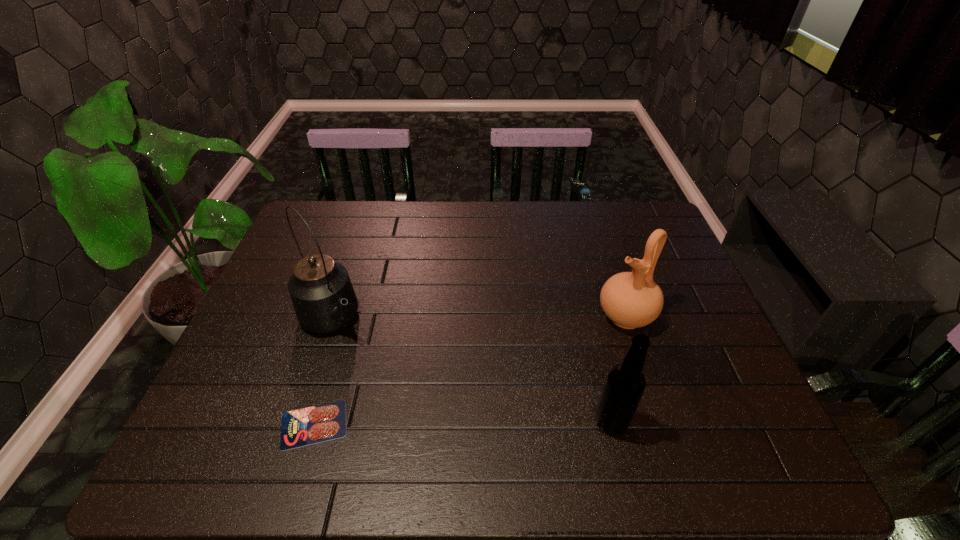
Identify the location of free space on the desktop that is between the salami and the beer bottle and is positioned spout on the tallest object. (428, 423).

The height and width of the screenshot is (540, 960). I want to click on vacant space on the desktop that is between the shortest object and the beer bottle and is positioned on the spout of the pottery, so (461, 423).